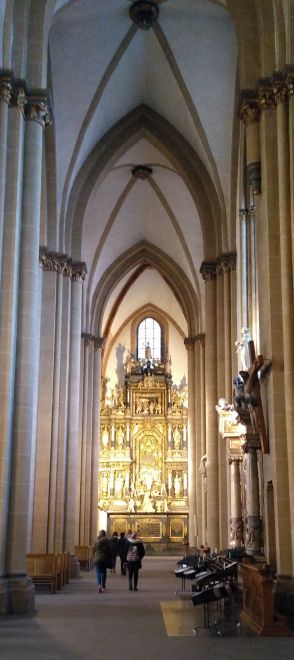
Image resolution: width=294 pixels, height=660 pixels. Identify the location of pillar. tap(250, 486).